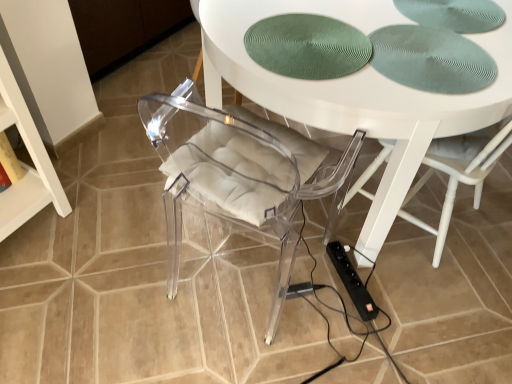
Question: Is the depth of white glossy table at center greater than that of black plastic extension cord at lower right?

Choices:
 (A) no
 (B) yes

Answer: (A)

Question: Considering the relative positions of white glossy table at center and black plastic extension cord at lower right in the image provided, is white glossy table at center to the right of black plastic extension cord at lower right from the viewer's perspective?

Choices:
 (A) yes
 (B) no

Answer: (A)

Question: Is white glossy table at center thinner than black plastic extension cord at lower right?

Choices:
 (A) no
 (B) yes

Answer: (A)

Question: Is white glossy table at center directly adjacent to black plastic extension cord at lower right?

Choices:
 (A) yes
 (B) no

Answer: (B)

Question: Is white glossy table at center positioned far away from black plastic extension cord at lower right?

Choices:
 (A) yes
 (B) no

Answer: (B)

Question: From a real-world perspective, does white glossy table at center stand above black plastic extension cord at lower right?

Choices:
 (A) yes
 (B) no

Answer: (A)

Question: Is black plastic extension cord at lower right at the right side of white glossy table at center?

Choices:
 (A) yes
 (B) no

Answer: (B)

Question: Is black plastic extension cord at lower right completely or partially outside of white glossy table at center?

Choices:
 (A) yes
 (B) no

Answer: (B)

Question: Does black plastic extension cord at lower right have a larger size compared to white glossy table at center?

Choices:
 (A) yes
 (B) no

Answer: (B)

Question: Does black plastic extension cord at lower right have a smaller size compared to white glossy table at center?

Choices:
 (A) no
 (B) yes

Answer: (B)

Question: Does black plastic extension cord at lower right have a lesser height compared to white glossy table at center?

Choices:
 (A) no
 (B) yes

Answer: (B)

Question: Considering the relative sizes of black plastic extension cord at lower right and white glossy table at center in the image provided, is black plastic extension cord at lower right taller than white glossy table at center?

Choices:
 (A) yes
 (B) no

Answer: (B)

Question: From the image's perspective, relative to black plastic extension cord at lower right, is white glossy table at center above or below?

Choices:
 (A) above
 (B) below

Answer: (A)